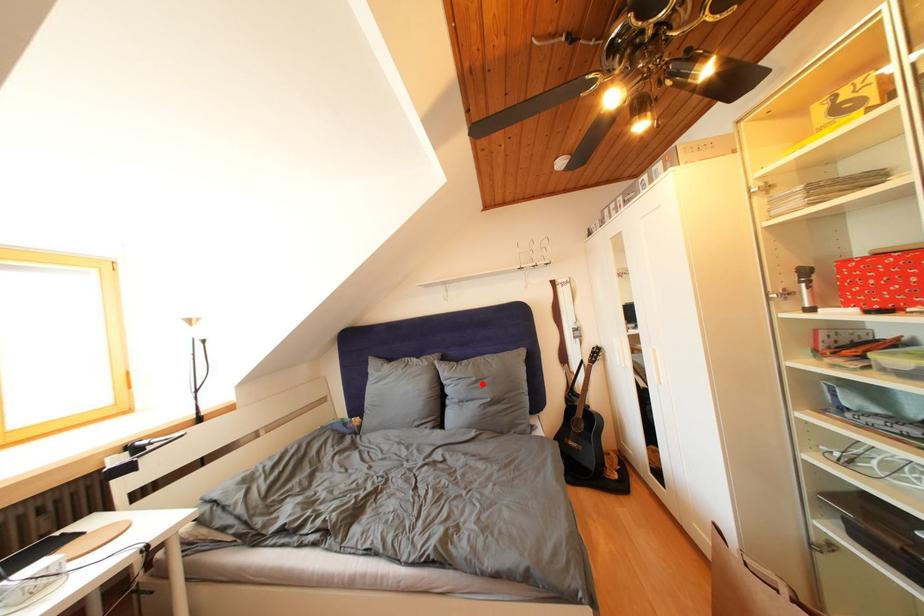
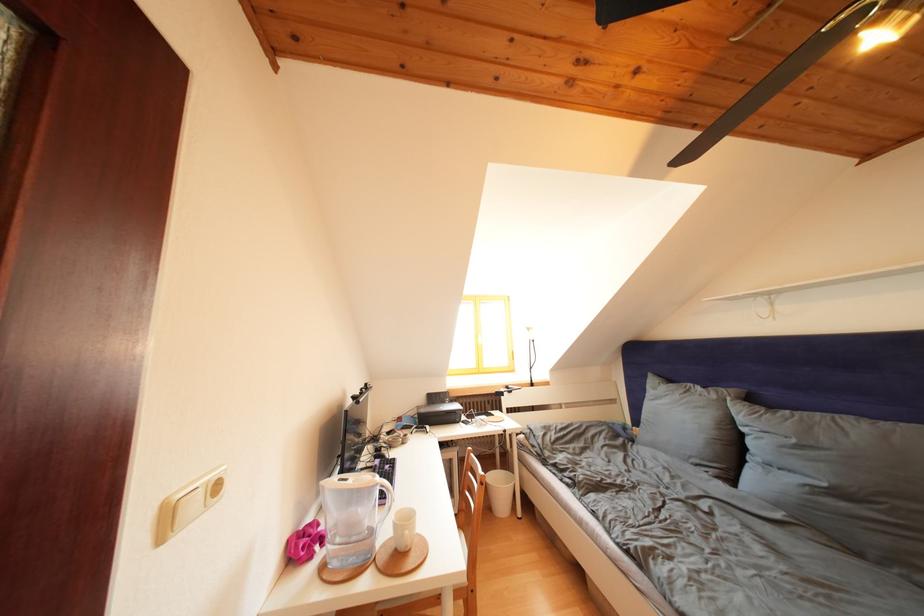
In the second image, find the point that corresponds to the highlighted location in the first image.

(801, 446)